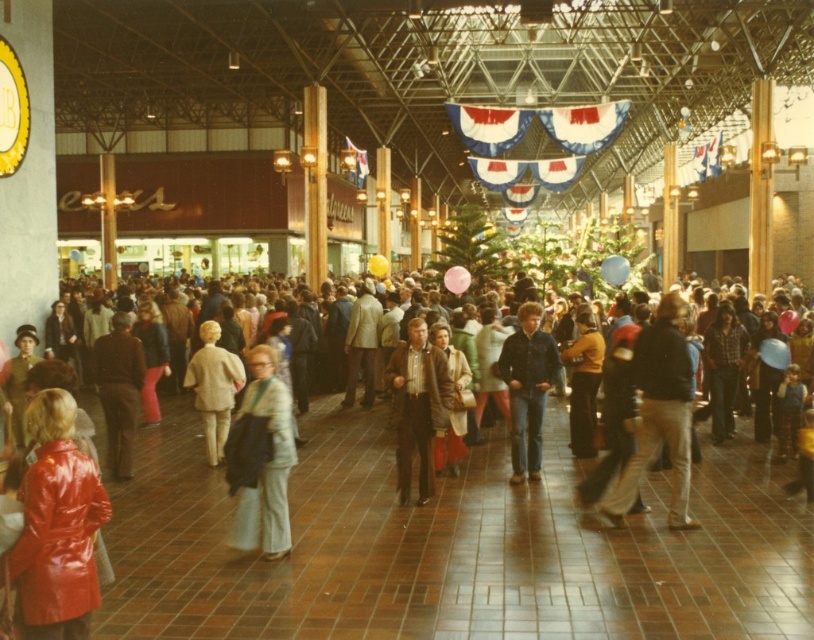
Question: Which point is closer to the camera?

Choices:
 (A) (187, 384)
 (B) (407, 349)

Answer: (B)

Question: In this image, where is light brown leather jacket at center located relative to light beige coat at center?

Choices:
 (A) above
 (B) below

Answer: (A)

Question: Which object appears closest to the camera in this image?

Choices:
 (A) light beige coat at center
 (B) light brown leather jacket at center
 (C) light gray fabric coat at center

Answer: (C)

Question: Does light gray fabric coat at center have a larger size compared to brown leather jacket at center?

Choices:
 (A) yes
 (B) no

Answer: (B)

Question: Is light gray fabric coat at center thinner than brown leather jacket at center?

Choices:
 (A) no
 (B) yes

Answer: (A)

Question: Which object is closer to the camera taking this photo?

Choices:
 (A) light beige coat at center
 (B) shiny red coat at lower left
 (C) light brown leather jacket at center
 (D) denim jacket at center

Answer: (B)